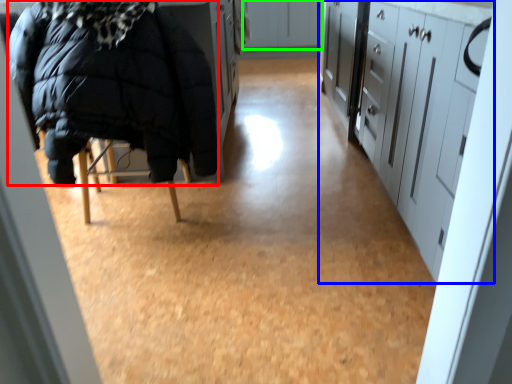
Question: Which object is the closest to the jacket (highlighted by a red box)? Choose among these: cabinetry (highlighted by a blue box) or cabinetry (highlighted by a green box).

Choices:
 (A) cabinetry
 (B) cabinetry

Answer: (A)